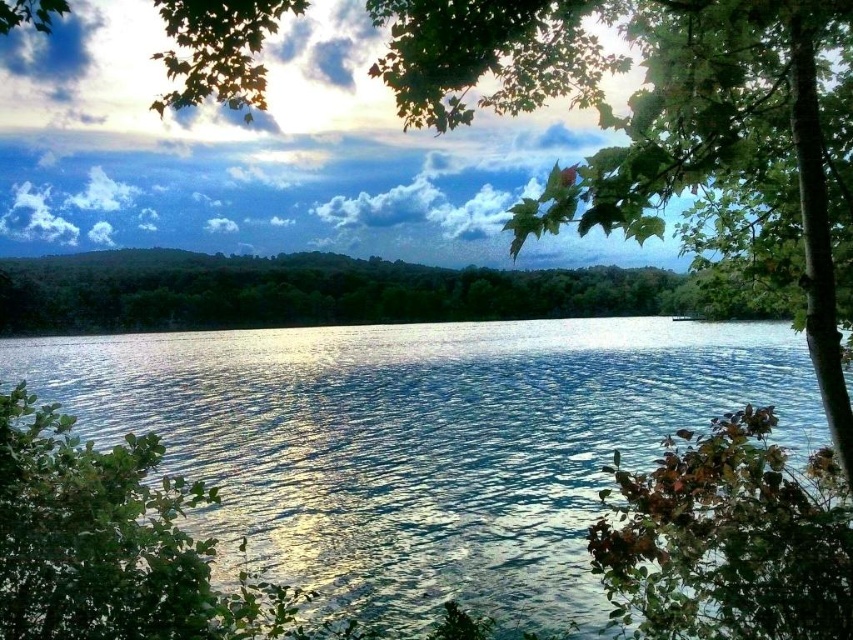
You are standing at the lakeside and want to take a photo that includes both the glistening blue water at center and the green leafy tree at lower left. Which object should you position closer to the edge of the frame to ensure both are visible?

You should position the green leafy tree at lower left closer to the edge of the frame since the glistening blue water at center might be wider than the tree, allowing more space for the tree to fit within the frame.

You are standing at the lakeside and want to take a photo of the glistening blue water at center and the green leafy tree at lower left. Which object will appear larger in the photo?

The glistening blue water at center will appear larger in the photo because it is much taller than the green leafy tree at lower left.